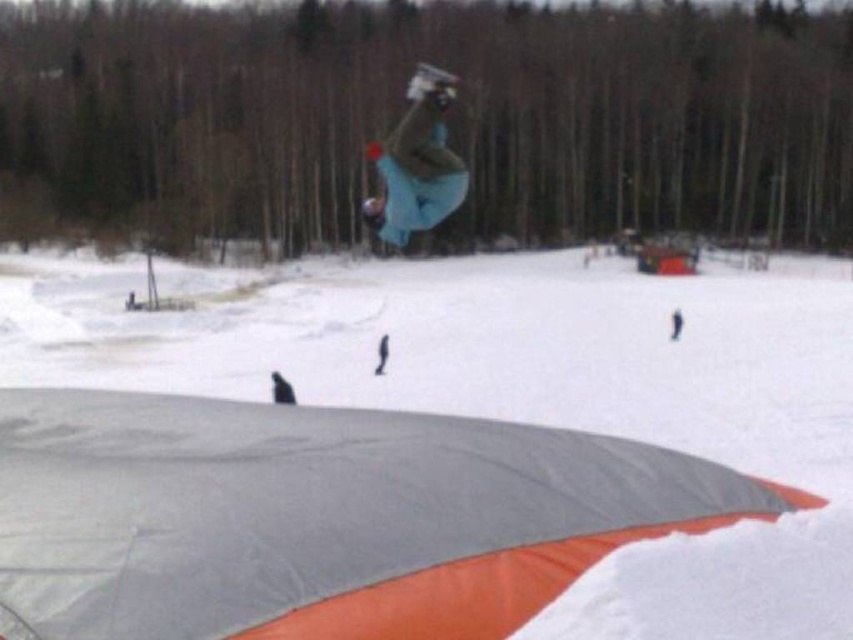
You are a photographer trying to capture the snowboarder. According to the scene, which object is closer to you, the white matte snow at center or the blue fabric snowboarder at center?

The white matte snow at center is closer to the viewer than the blue fabric snowboarder at center.

You are a photographer trying to capture the blue fabric snowboarder at center. Since the white matte snow at center is underneath them, will the snowboarder be visible against the snow background?

The white matte snow at center is positioned under the blue fabric snowboarder at center, so the snowboarder will be visible because the blue color contrasts with the white snow background.